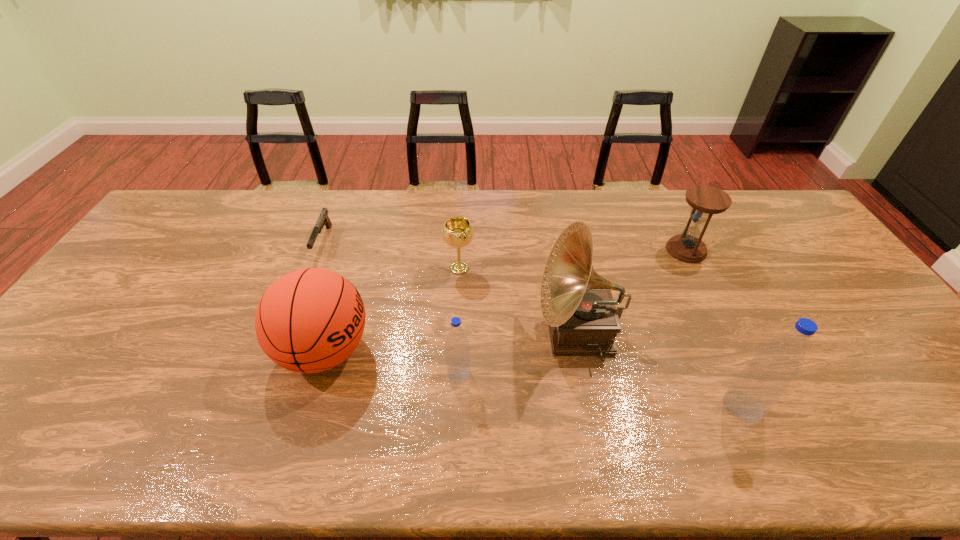
Please point a spot to add another water bottle on the left. Please provide its 2D coordinates. Your answer should be formatted as a tuple, i.e. [(x, y)], where the tuple contains the x and y coordinates of a point satisfying the conditions above.

[(206, 342)]